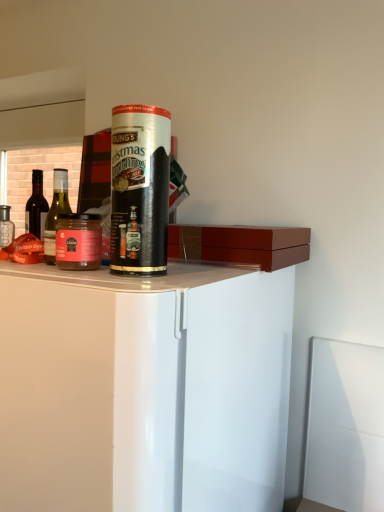
Where is `vacant region in front of matte glass jar at left`? The image size is (384, 512). vacant region in front of matte glass jar at left is located at coordinates (83, 276).